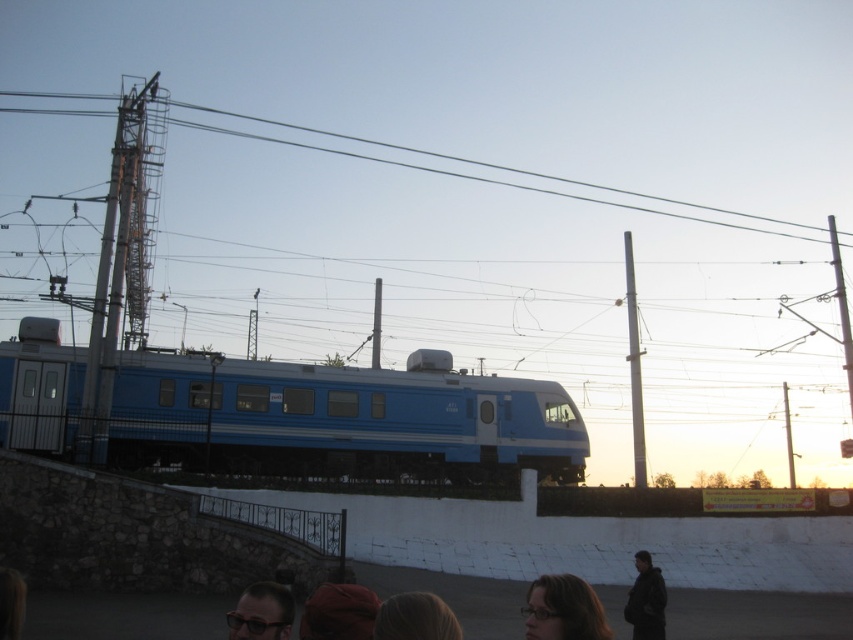
Question: Considering the real-world distances, which object is closest to the dark gray jacket at lower right?

Choices:
 (A) matte black glasses at lower center
 (B) blonde hair at lower center
 (C) velvet brown hat at lower center

Answer: (B)

Question: Where is matte black glasses at lower center located in relation to dark gray jacket at lower right in the image?

Choices:
 (A) above
 (B) below

Answer: (A)

Question: Can you confirm if metallic wire at upper center is positioned above dark gray jacket at lower right?

Choices:
 (A) yes
 (B) no

Answer: (A)

Question: Based on their relative distances, which object is farther from the blonde hair at lower center?

Choices:
 (A) matte black hair at lower center
 (B) metallic wire at upper center

Answer: (B)

Question: Which object is farther from the camera taking this photo?

Choices:
 (A) matte black hair at lower center
 (B) dark gray jacket at lower right
 (C) blonde hair at lower center

Answer: (B)

Question: Does matte black hair at lower center have a greater width compared to velvet brown hat at lower center?

Choices:
 (A) yes
 (B) no

Answer: (A)